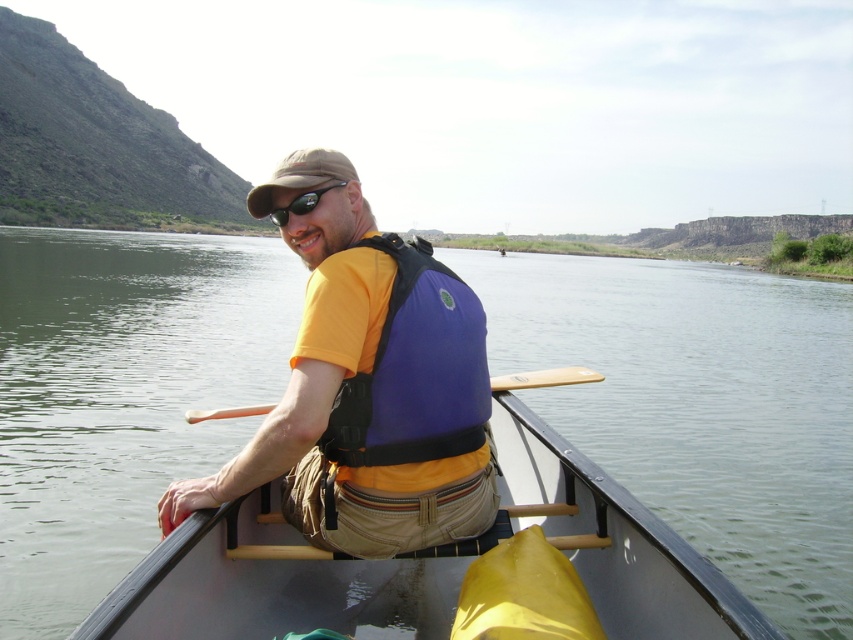
You are a photographer trying to capture the smooth gray canoe at center and the tan fabric baseball cap at upper center in a single shot. Based on their positions, which object will appear larger in the photo?

The smooth gray canoe at center will appear larger in the photo because it is closer to the viewer than the tan fabric baseball cap at upper center.

You are standing at the point with coordinates [432,557] in the image. What object is located at that point?

The smooth gray canoe at center is located at point [432,557].